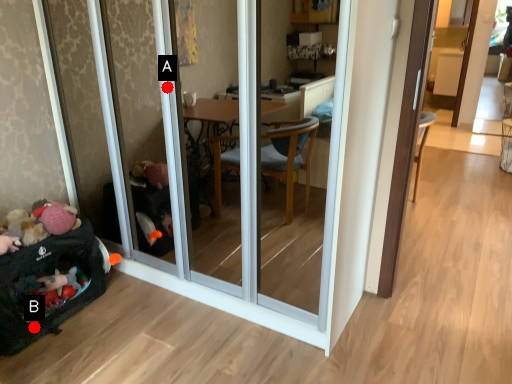
Question: Two points are circled on the image, labeled by A and B beside each circle. Which of the following is the closest to the observer?

Choices:
 (A) A is closer
 (B) B is closer

Answer: (A)